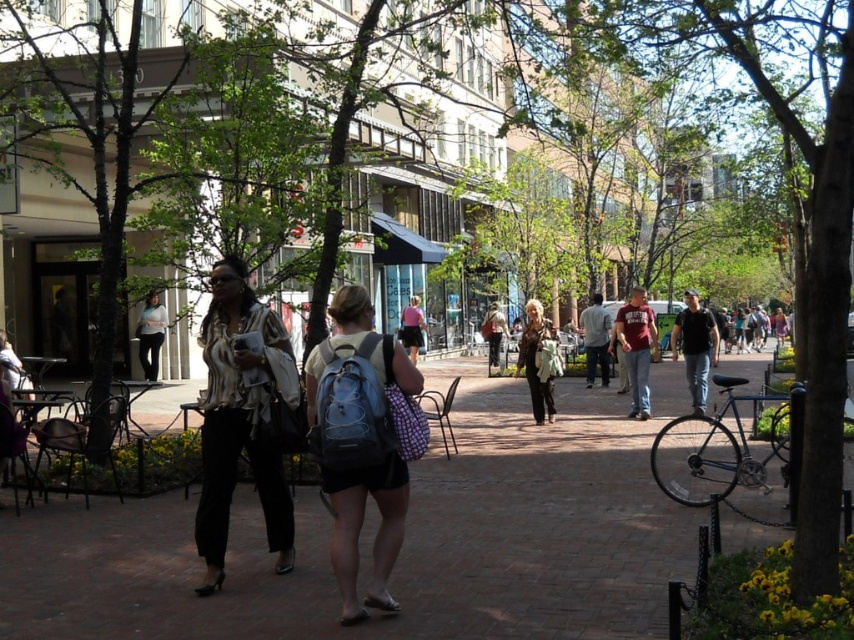
Who is higher up, leather jacket at center or matte black backpack at center?

Positioned higher is matte black backpack at center.

Looking at this image, can you confirm if leather jacket at center is bigger than matte black backpack at center?

No.

What do you see at coordinates (535, 362) in the screenshot?
I see `leather jacket at center` at bounding box center [535, 362].

Locate an element on the screen. This screenshot has width=854, height=640. leather jacket at center is located at coordinates (535, 362).

Between brick pavement at center and matte black backpack at center, which one appears on the left side from the viewer's perspective?

brick pavement at center

Is brick pavement at center positioned at the back of matte black backpack at center?

No, brick pavement at center is closer to the viewer.

Is point (502, 570) farther from viewer compared to point (499, 320)?

No.

The height and width of the screenshot is (640, 854). I want to click on brick pavement at center, so click(x=402, y=544).

What do you see at coordinates (695, 346) in the screenshot? I see `dark blue jeans at center` at bounding box center [695, 346].

Identify the location of dark blue jeans at center. This screenshot has width=854, height=640. (695, 346).